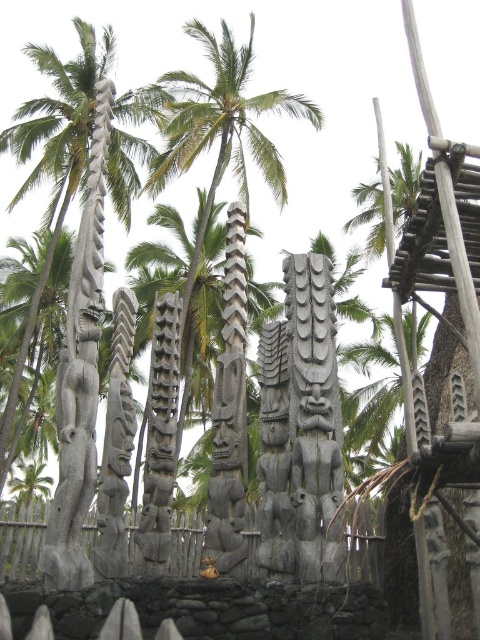
Question: Observing the image, what is the correct spatial positioning of dark gray wood totem pole at center in reference to dark gray stone totem pole at center?

Choices:
 (A) below
 (B) above

Answer: (A)

Question: Can you confirm if gray stone totem pole at center is bigger than dark gray wooden fence at center?

Choices:
 (A) no
 (B) yes

Answer: (A)

Question: Among these objects, which one is farthest from the camera?

Choices:
 (A) dark gray wooden fence at center
 (B) dark gray stone totem pole at center
 (C) dark gray wood totem pole at center
 (D) gray stone totem pole at center

Answer: (C)

Question: Can you confirm if gray stone totem pole at center is smaller than dark gray wood totem pole at center?

Choices:
 (A) no
 (B) yes

Answer: (A)

Question: Which of the following is the closest to the observer?

Choices:
 (A) dark gray wood totem pole at center
 (B) dark gray wooden fence at center
 (C) gray stone totem pole at center
 (D) dark gray stone totem pole at center

Answer: (C)

Question: Estimate the real-world distances between objects in this image. Which object is farther from the dark gray stone totem pole at center?

Choices:
 (A) dark gray wood totem pole at center
 (B) gray stone totem pole at center
 (C) dark gray wooden fence at center

Answer: (B)